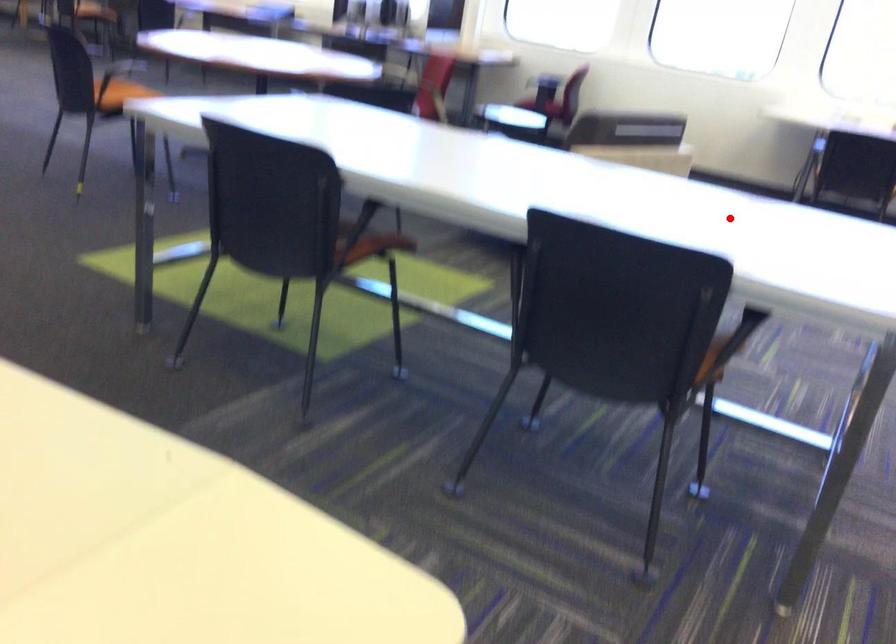
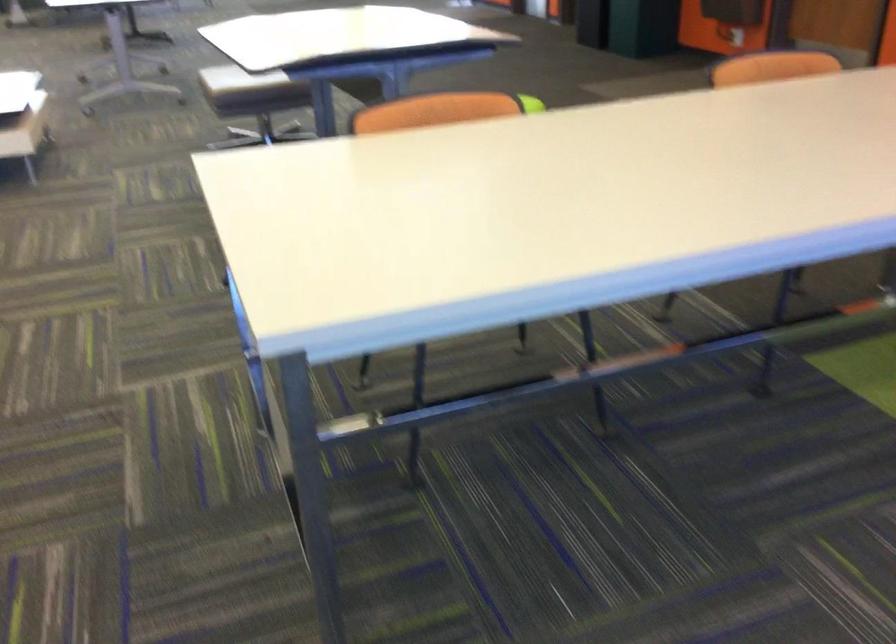
Question: I am providing you with two images of the same scene from different viewpoints. Image1 has a red point marked. In image2, the corresponding 3D location appears at what relative position? Reply with the corresponding letter.

Choices:
 (A) Closer
 (B) Farther

Answer: (A)